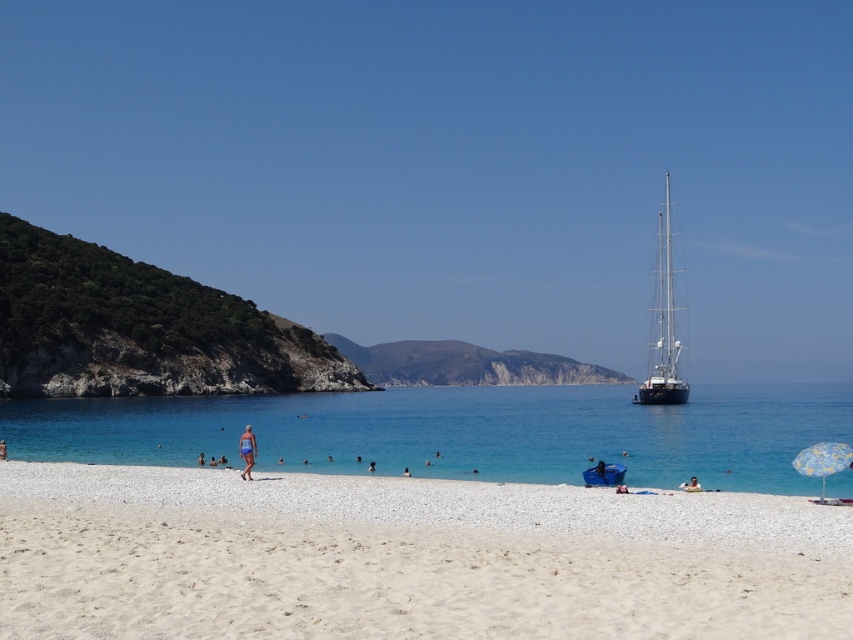
You are a photographer trying to capture both the blue fabric swimsuit at center and the blue swimsuit at lower left in a single shot. Which swimsuit will appear larger in the photo?

The blue swimsuit at lower left will appear larger in the photo because it is bigger than the blue fabric swimsuit at center.

You are standing on the beach and see two people wearing blue swimsuits. One is wearing a blue fabric swimsuit at center and the other is wearing a blue swimsuit at lower left. Which swimmer is closer to you?

The blue fabric swimsuit at center is closer to the viewer than the blue swimsuit at lower left, so the swimmer in the blue fabric swimsuit at center is closer to you.

You are standing at the point marked by the coordinates point [370,467] in the image. Looking around, you see a blue fabric person at lower center. Which direction should you face to look towards the rocky cliff covered with green vegetation on the left side of the image?

The rocky cliff covered with green vegetation is on the left side of the image. Since you are at point [370,467], which marks the blue fabric person at lower center, you should turn your body to face the left side to look towards the rocky cliff covered with green vegetation.